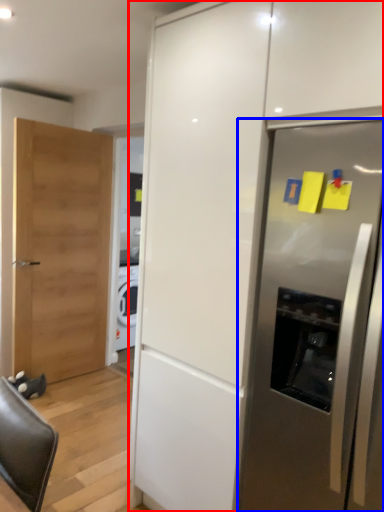
Question: Which object appears farthest to the camera in this image, cabinetry (highlighted by a red box) or refrigerator (highlighted by a blue box)?

Choices:
 (A) cabinetry
 (B) refrigerator

Answer: (B)